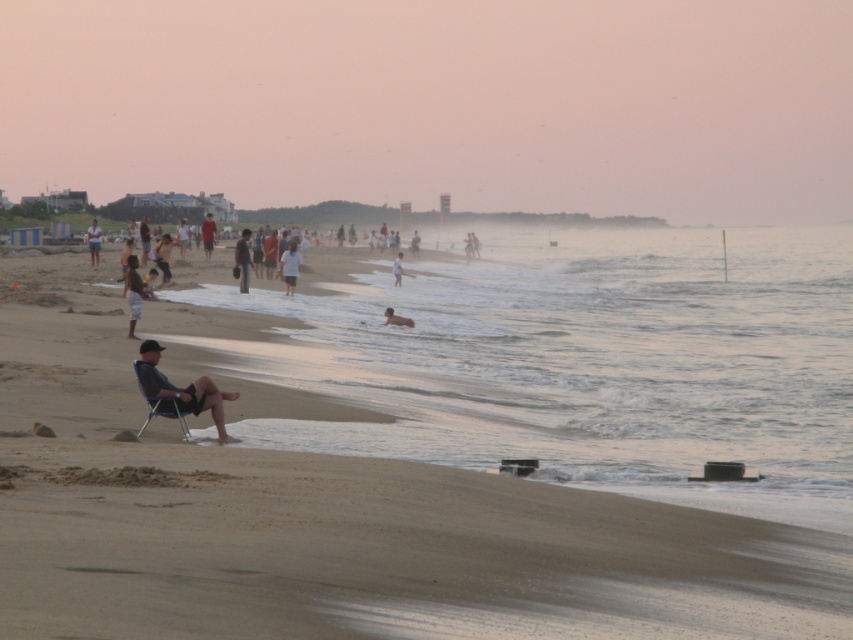
Does dark brown shorts at left have a smaller size compared to blue plastic chair at center?

Indeed, dark brown shorts at left has a smaller size compared to blue plastic chair at center.

Which is in front, point (132, 268) or point (165, 400)?

Point (165, 400) is in front.

Does point (131, 262) lie behind point (149, 417)?

Yes.

Where is `dark brown shorts at left`? dark brown shorts at left is located at coordinates (132, 291).

Does dark blue shirt at center have a smaller size compared to smooth skin child at center?

Indeed, dark blue shirt at center has a smaller size compared to smooth skin child at center.

Can you confirm if dark blue shirt at center is taller than smooth skin child at center?

No, dark blue shirt at center is not taller than smooth skin child at center.

At what (x,y) coordinates should I click in order to perform the action: click on dark blue shirt at center. Please return your answer as a coordinate pair (x, y). This screenshot has width=853, height=640. Looking at the image, I should click on (242, 260).

Can you confirm if dark blue fabric chair at lower left is positioned to the right of dark blue shirt at center?

Correct, you'll find dark blue fabric chair at lower left to the right of dark blue shirt at center.

Who is more distant from viewer, (x=213, y=392) or (x=242, y=246)?

The point (x=242, y=246) is behind.

At what (x,y) coordinates should I click in order to perform the action: click on dark blue fabric chair at lower left. Please return your answer as a coordinate pair (x, y). This screenshot has height=640, width=853. Looking at the image, I should click on (181, 390).